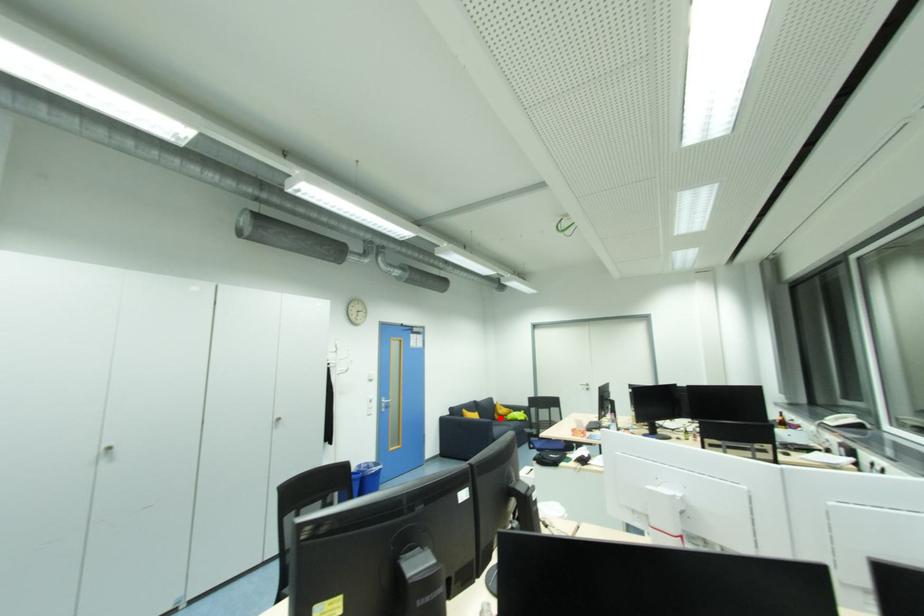
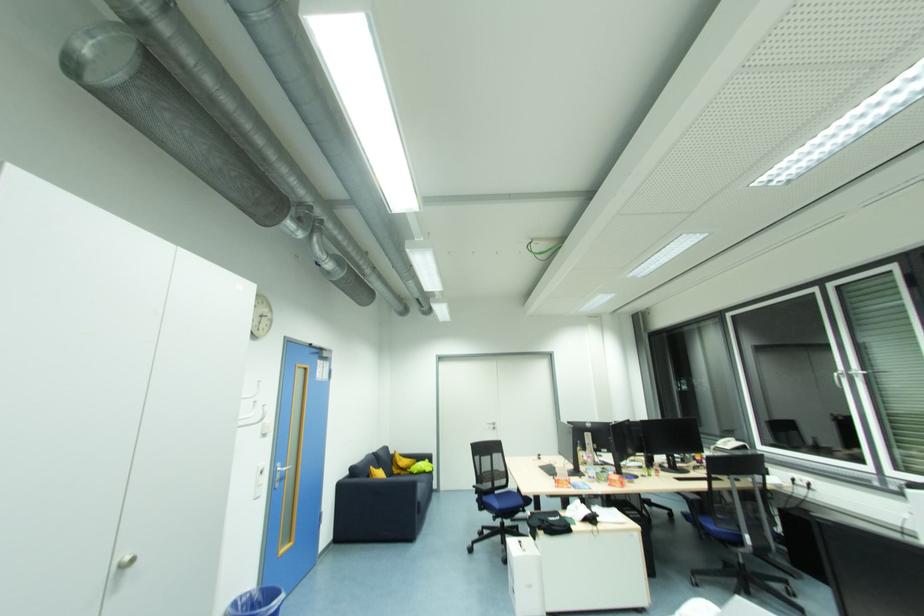
Locate, in the second image, the point that corresponds to the highlighted location in the first image.

(398, 472)